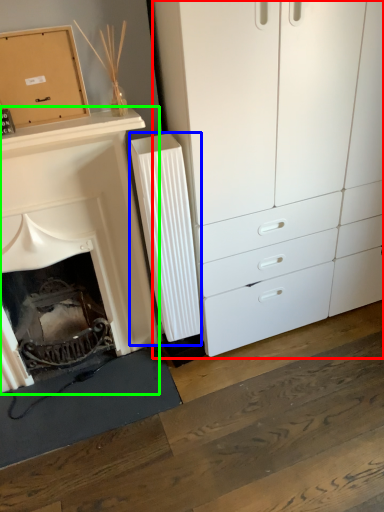
Question: Considering the real-world distances, which object is closest to chest of drawers (highlighted by a red box)? radiator (highlighted by a blue box) or fireplace (highlighted by a green box).

Choices:
 (A) radiator
 (B) fireplace

Answer: (A)